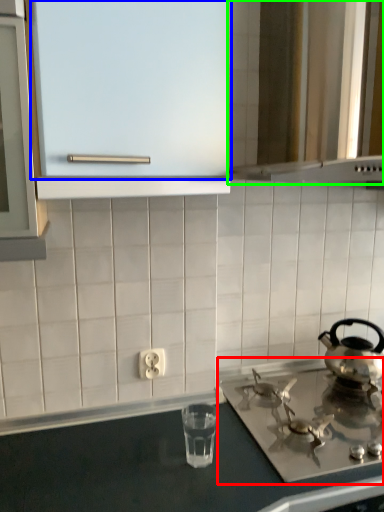
Question: Which is farther away from gas stove (highlighted by a red box)? glass door (highlighted by a blue box) or vent (highlighted by a green box)?

Choices:
 (A) glass door
 (B) vent

Answer: (A)